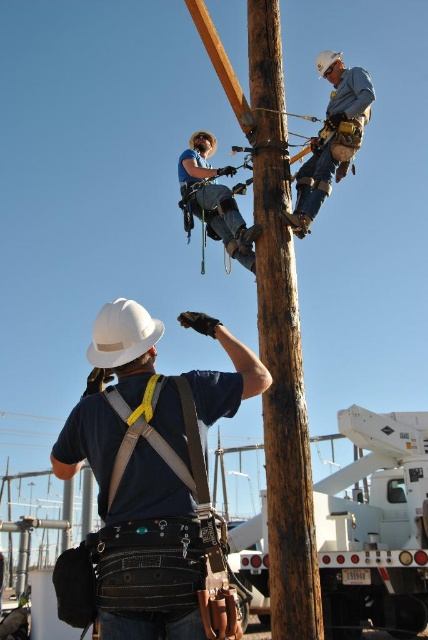
Question: Among these points, which one is farthest from the camera?

Choices:
 (A) (365, 97)
 (B) (223, 609)
 (C) (275, 204)

Answer: (A)

Question: Is white matte hard hat at center thinner than blue denim jeans at center?

Choices:
 (A) no
 (B) yes

Answer: (A)

Question: In this image, where is white matte hard hat at center located relative to white metallic trailer truck at lower right?

Choices:
 (A) left
 (B) right

Answer: (A)

Question: Among these objects, which one is farthest from the camera?

Choices:
 (A) white hard hat at center
 (B) white matte hard hat at center
 (C) blue denim jeans at center
 (D) white metallic trailer truck at lower right

Answer: (D)

Question: Estimate the real-world distances between objects in this image. Which object is closer to the white hard hat at center?

Choices:
 (A) blue denim jeans at upper center
 (B) brown rough wood telegraph pole at center
 (C) blue denim jeans at center
 (D) white metallic trailer truck at lower right

Answer: (C)

Question: Is white metallic trailer truck at lower right thinner than white hard hat at center?

Choices:
 (A) no
 (B) yes

Answer: (A)